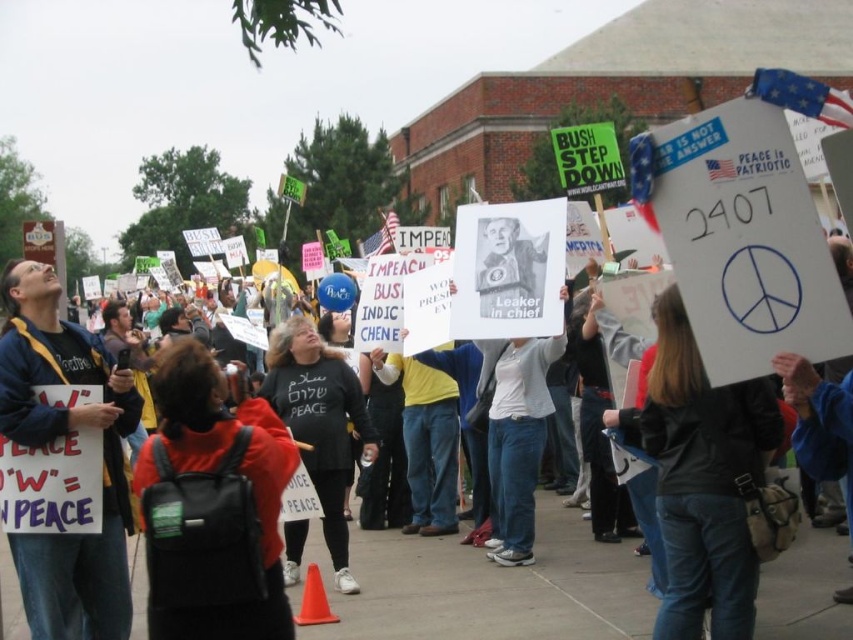
Question: Considering the relative positions of black fabric jacket at center and yellow shirt at center in the image provided, where is black fabric jacket at center located with respect to yellow shirt at center?

Choices:
 (A) above
 (B) below

Answer: (B)

Question: Estimate the real-world distances between objects in this image. Which object is farther from the light gray sweater at center?

Choices:
 (A) black cotton shirt at center
 (B) black fabric jacket at center

Answer: (B)

Question: Estimate the real-world distances between objects in this image. Which object is closer to the black backpack at center?

Choices:
 (A) black leather jacket at center
 (B) black cotton shirt at center
 (C) light gray sweater at center
 (D) yellow shirt at center

Answer: (B)

Question: Is black leather jacket at center smaller than blue denim jacket at left?

Choices:
 (A) yes
 (B) no

Answer: (A)

Question: Does black leather jacket at center appear over black backpack at center?

Choices:
 (A) no
 (B) yes

Answer: (A)

Question: Considering the real-world distances, which object is farthest from the black fabric jacket at center?

Choices:
 (A) yellow shirt at center
 (B) black cotton shirt at center

Answer: (B)